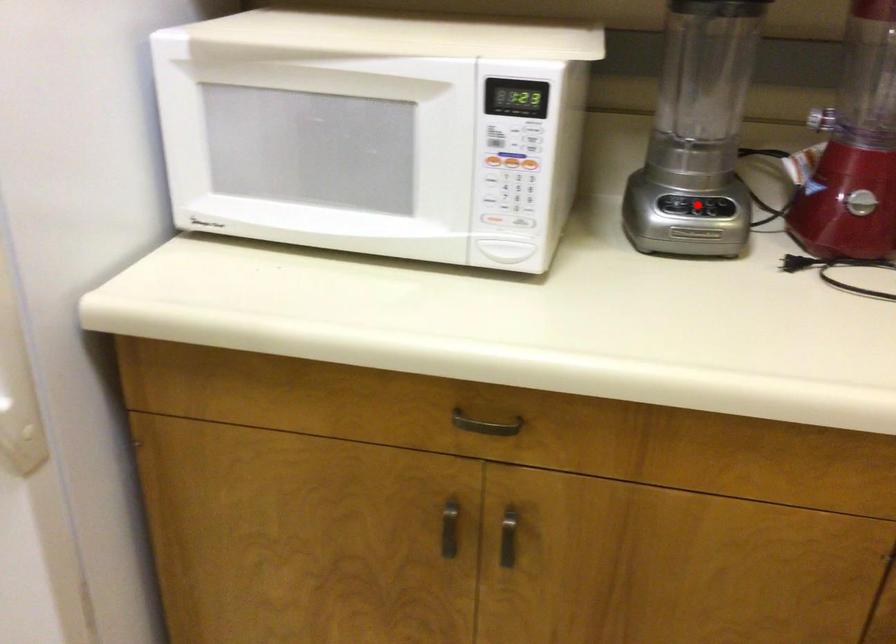
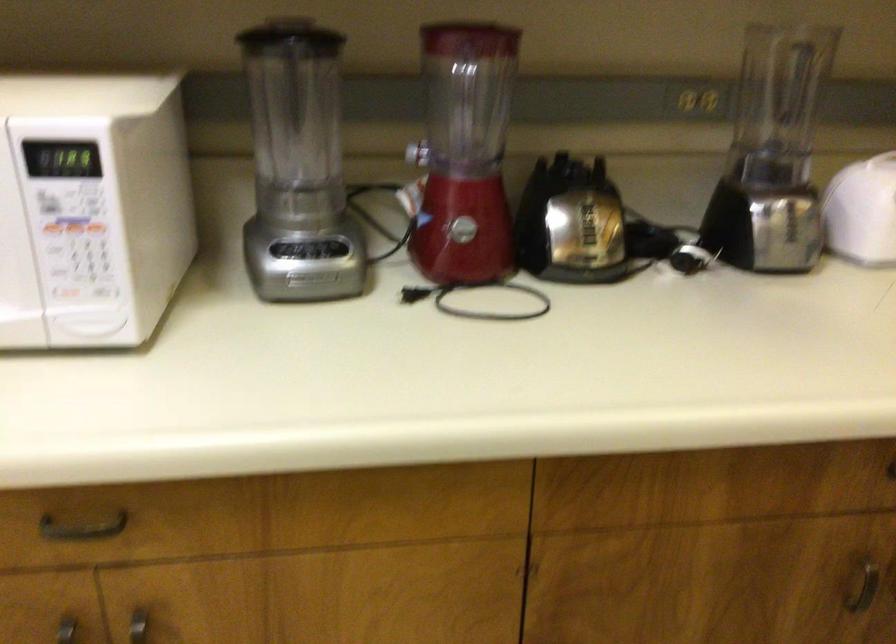
In the second image, find the point that corresponds to the highlighted location in the first image.

(308, 249)